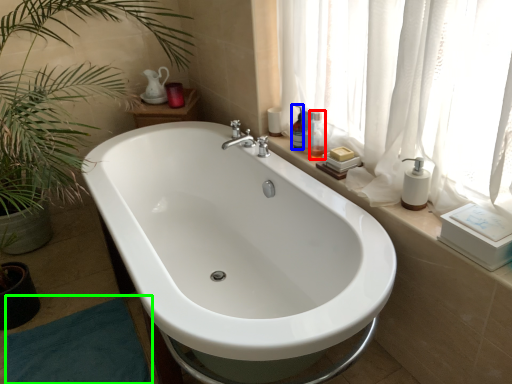
Question: Which object is positioned closest to toiletry (highlighted by a red box)? Select from toiletry (highlighted by a blue box) and bath mat (highlighted by a green box).

Choices:
 (A) toiletry
 (B) bath mat

Answer: (A)